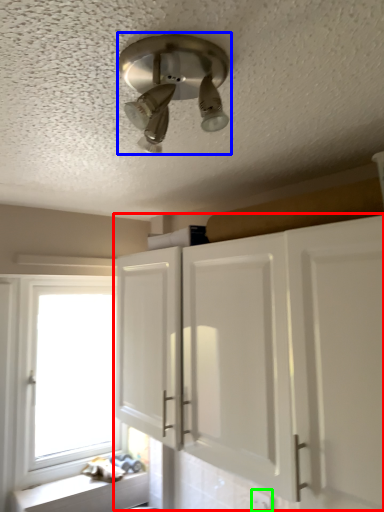
Question: Considering the real-world distances, which object is farthest from cabinetry (highlighted by a red box)? light fixture (highlighted by a blue box) or electric outlet (highlighted by a green box)?

Choices:
 (A) light fixture
 (B) electric outlet

Answer: (A)